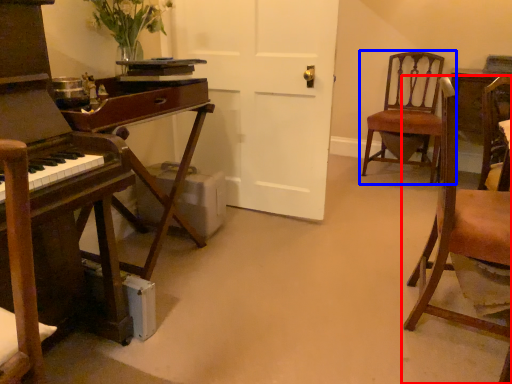
Question: Which point is further to the camera, chair (highlighted by a red box) or chair (highlighted by a blue box)?

Choices:
 (A) chair
 (B) chair

Answer: (B)